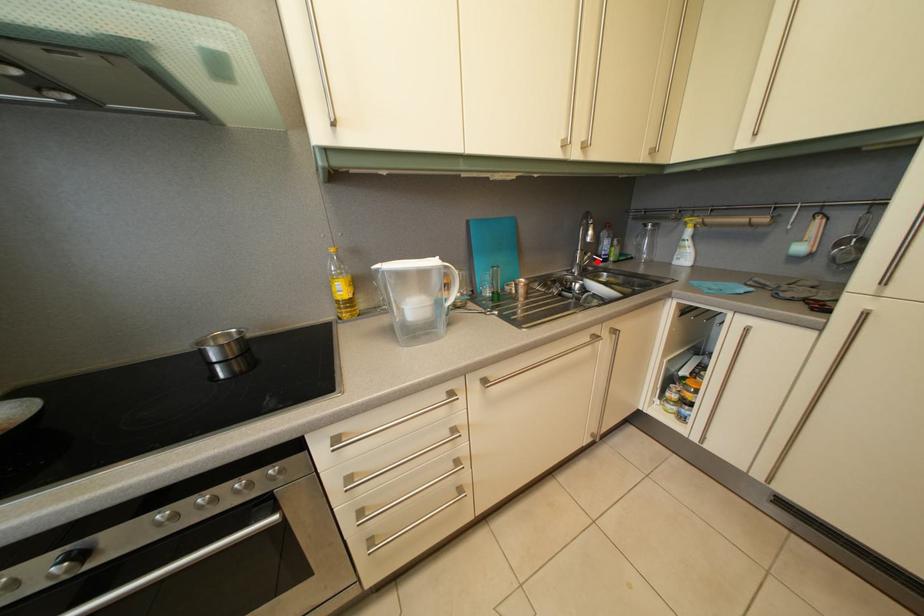
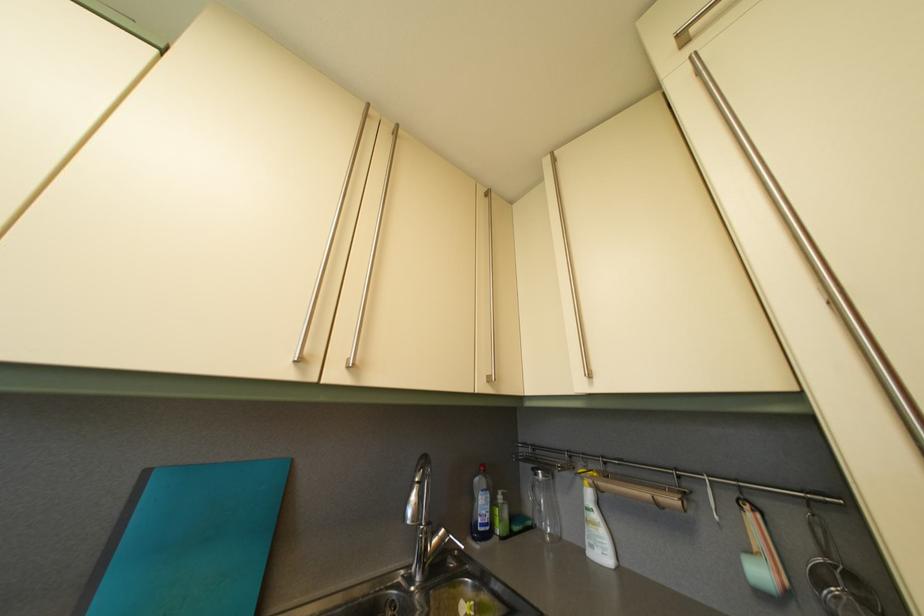
Question: I am providing you with two images of the same scene from different viewpoints. In image1, a red point is highlighted. Considering the same 3D point in image2, which of the following is correct?

Choices:
 (A) It is closer
 (B) It is farther

Answer: (B)